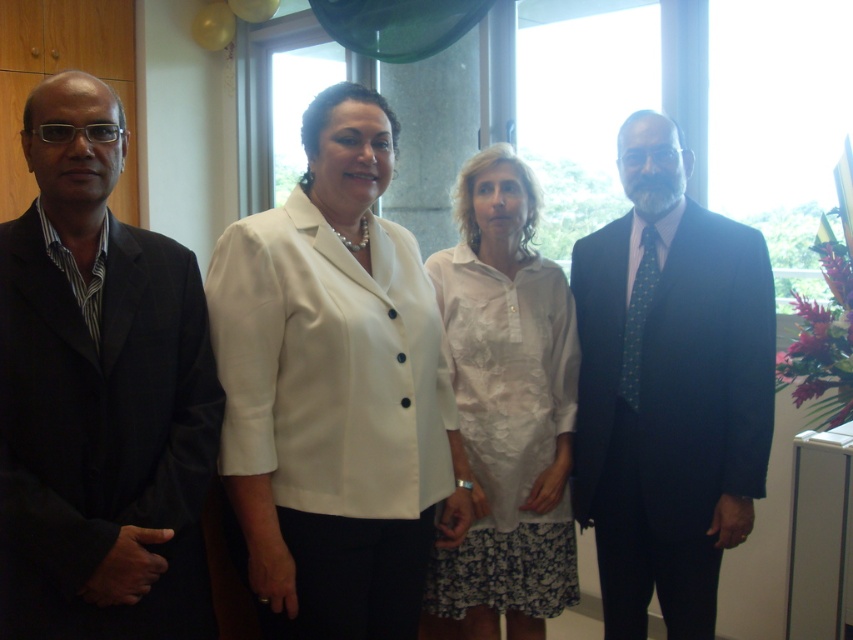
You are standing in the conference room and need to determine which of the two points, point (73, 237) or point (486, 182), is closer to you. Based on the scene, which point should you approach first?

Point (73, 237) is closer to the viewer than point (486, 182), so you should approach point (73, 237) first.

You are a photographer setting up for a group photo. You need to ensure that the white matte blazer at center and the black matte suit at left are both visible in the frame. Based on their heights, which one might need to be positioned closer to the camera to avoid being obscured?

The black matte suit at left is shorter than the white matte blazer at center. To ensure visibility, the black matte suit at left should be positioned closer to the camera so it isn not obscured by the taller white matte blazer at center.

You are standing in the conference room and want to place a small plant at the point marked as point (334,390). Which object is this point located on?

The point (334,390) is located on the white matte blazer at center.